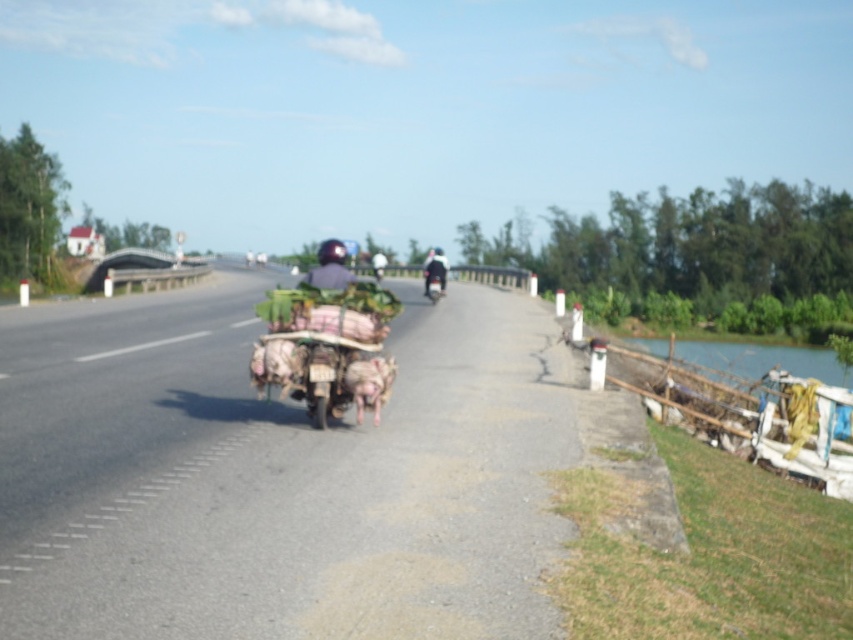
You are a delivery driver planning to drive your shiny black motorcycle at center along the smooth asphalt road at center. Considering the size difference between the two, will you have enough space to maneuver comfortably?

The smooth asphalt road at center has a larger size compared to the shiny black motorcycle at center, so yes, there will be enough space to maneuver comfortably.

Consider the image. You are a delivery person who needs to pass through a narrow bridge ahead. The bridge can only accommodate one vehicle at a time. You see a rusty metal cart at center and a shiny black motorcycle at center. Which vehicle should you let pass first if you want to ensure the narrowest vehicle goes through first?

The shiny black motorcycle at center is narrower than the rusty metal cart at center, so you should let the shiny black motorcycle at center pass first through the narrow bridge.